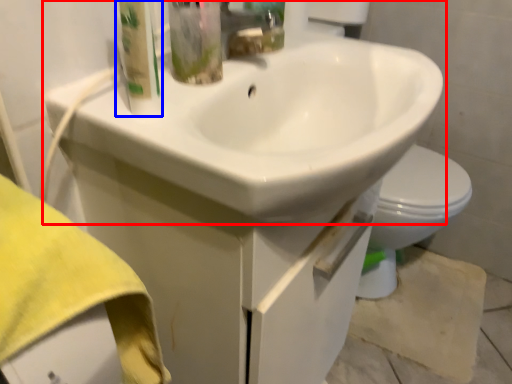
Question: Which object appears farthest to the camera in this image, sink (highlighted by a red box) or cleaning product (highlighted by a blue box)?

Choices:
 (A) sink
 (B) cleaning product

Answer: (B)